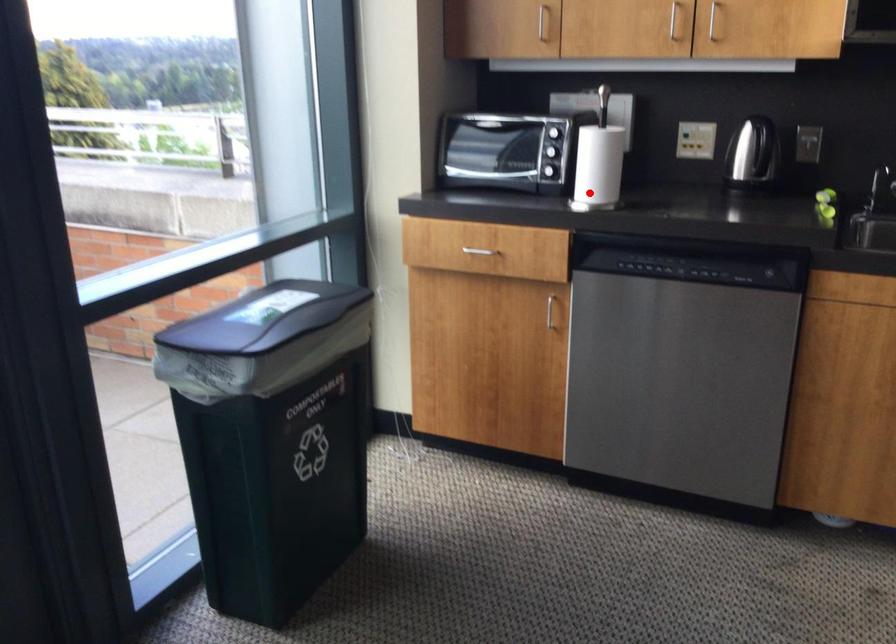
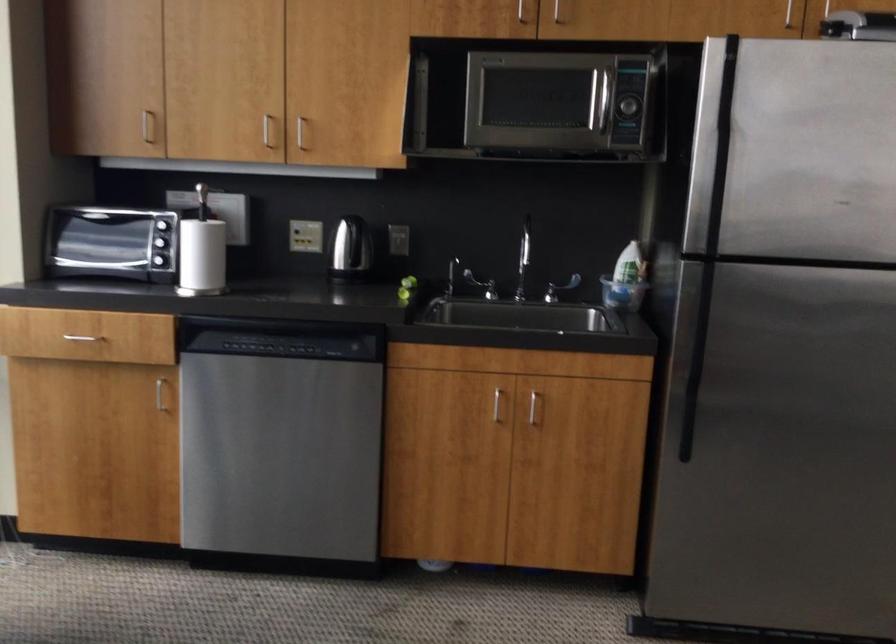
Locate, in the second image, the point that corresponds to the highlighted location in the first image.

(202, 281)